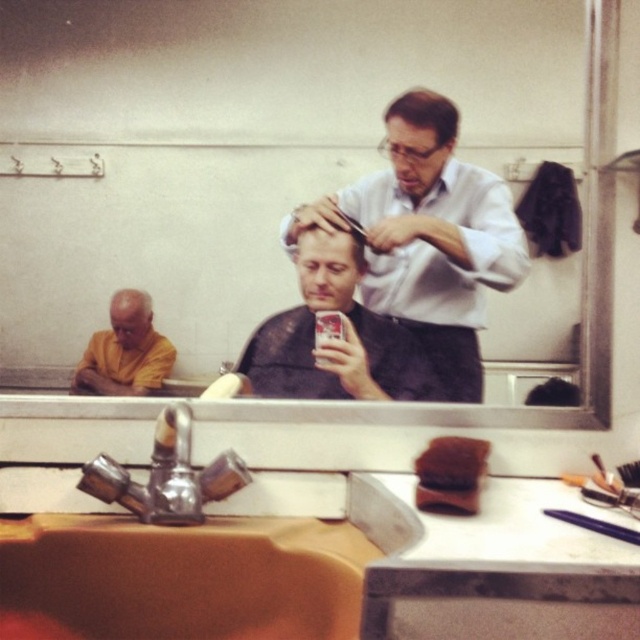
Question: Which point is farther to the camera?

Choices:
 (A) yellow cloth at left
 (B) sleek brown hair at center

Answer: (A)

Question: Considering the real-world distances, which object is farthest from the white shirt at upper center?

Choices:
 (A) reflective glass mirror at center
 (B) smooth brown hair at center
 (C) sleek brown hair at center
 (D) brushed metal faucet at lower left

Answer: (D)

Question: Is white shirt at upper center to the left of brown ceramic sink at lower center from the viewer's perspective?

Choices:
 (A) no
 (B) yes

Answer: (A)

Question: Which point is closer to the camera?

Choices:
 (A) (342, 598)
 (B) (372, 371)
 (C) (282, 212)
 (D) (356, 232)

Answer: (A)

Question: Can you confirm if white shirt at upper center is wider than sleek brown hair at center?

Choices:
 (A) no
 (B) yes

Answer: (B)

Question: Does brushed metal faucet at lower left come in front of sleek brown hair at center?

Choices:
 (A) no
 (B) yes

Answer: (B)